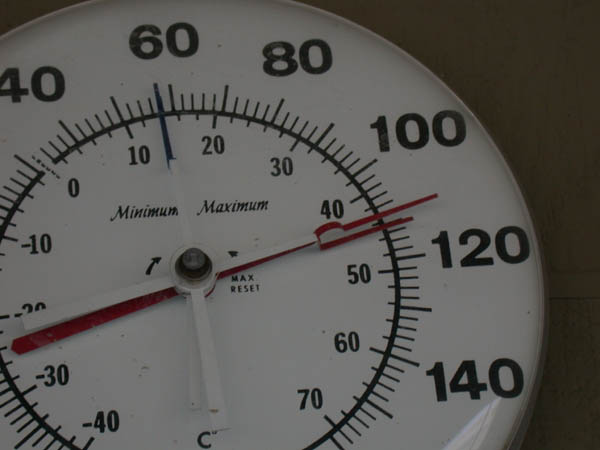
I want to click on color of clock, so click(x=472, y=168).